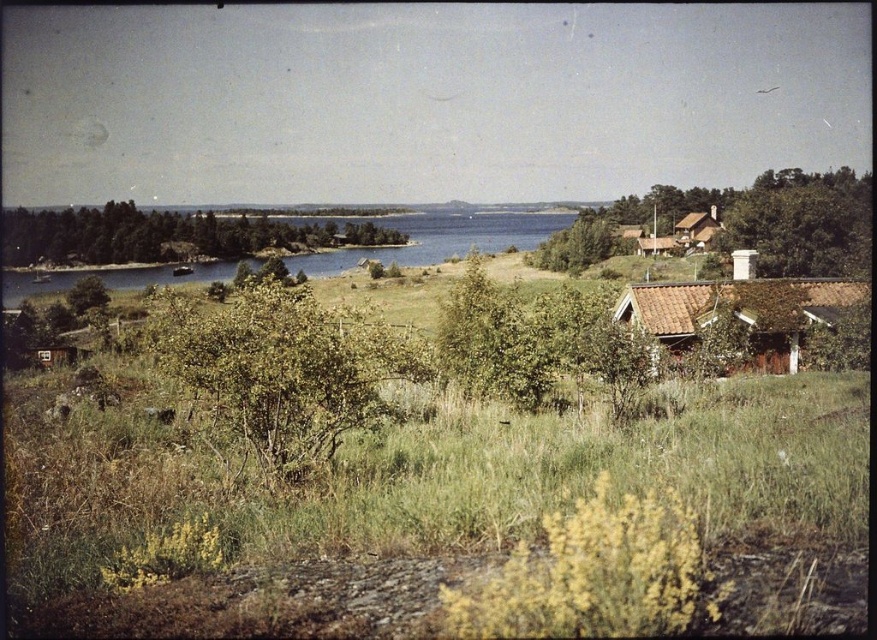
You are a photographer planning to take a landscape photo that includes both the brown tiled roof hut at right and the brown wooden hut at upper right. Which of the two huts will appear smaller in the photo?

The brown tiled roof hut at right will appear smaller in the photo because it is shorter than the brown wooden hut at upper right.

You are standing at the center of the image and see a point marked at coordinates (280, 372). What object is this point located on?

The point marked at coordinates (280, 372) is located on the green leafy bush at center.